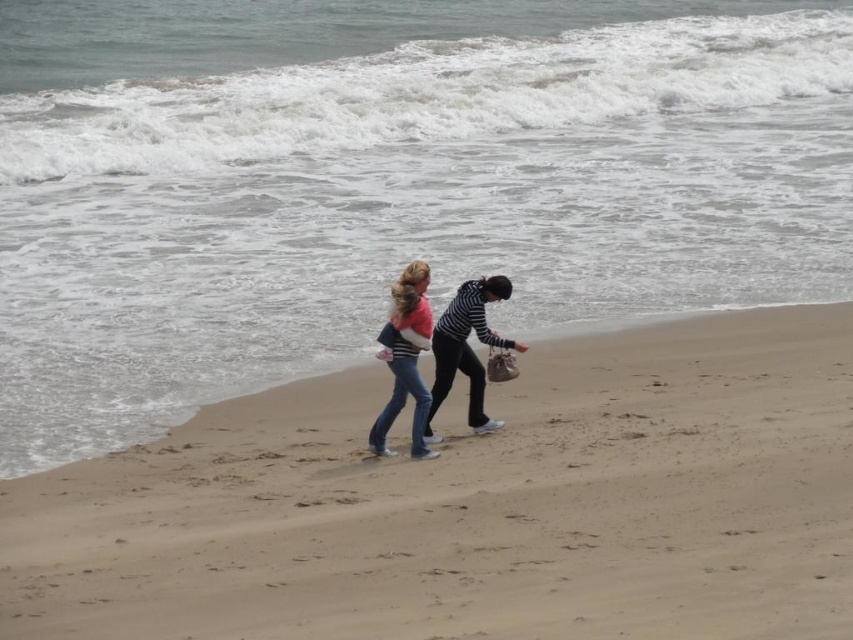
You are a photographer planning to take a picture of the denim jeans at center and the sandy beach at lower center. Based on their sizes, which object should you focus on first if you want to ensure both are in the frame without moving the camera?

The sandy beach at lower center is larger in size than the denim jeans at center, so you should focus on the sandy beach at lower center first to ensure both fit in the frame.

In the scene shown: You are standing on the sandy beach at lower center and want to reach the ocean waves that are 9.64 meters away. If you walk at a speed of 1.5 meters per second, how many seconds will it take you to reach the ocean waves?

The distance between the sandy beach at lower center and the ocean waves is 9.64 meters. Walking at 1.5 meters per second, it would take approximately 6.43 seconds to reach the ocean waves.

You are a photographer capturing a beach scene. You notice a striped fabric sweater at center and denim jeans at center. Which clothing item is positioned higher on the person?

The striped fabric sweater at center is above denim jeans at center, so the sweater is positioned higher on the person.